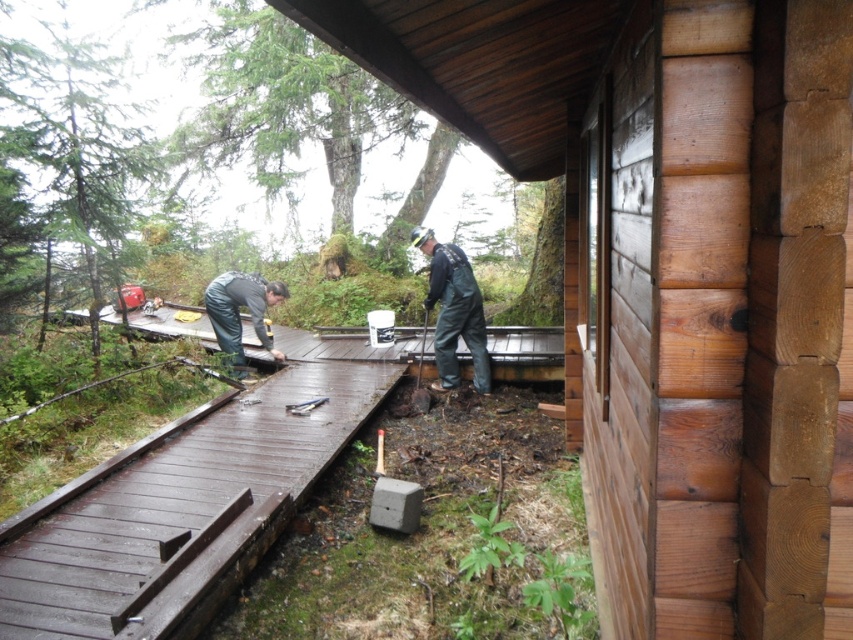
You are a construction worker who needs to move a heavy tool from the smooth wooden log cabin at center to the dark brown wood deck at center. Which object should you move it to first, considering their positions?

The smooth wooden log cabin at center is in front of the dark brown wood deck at center, so you should move the heavy tool to the dark brown wood deck at center first since it is behind the cabin and requires accessing the deck area.

You are a safety inspector checking the construction site. You notice two pairs of dark gray rubber boots at center and dark gray rubber boots at lower center. Which pair is covering the other?

The dark gray rubber boots at center is positioned over dark gray rubber boots at lower center.

You are standing in front of the wooden deck and need to determine the position of two points marked on the deck. Which point is closer to you, point (421, 244) or point (310, 404)?

Point (310, 404) is closer to you because it is less further to the camera than point (421, 244).